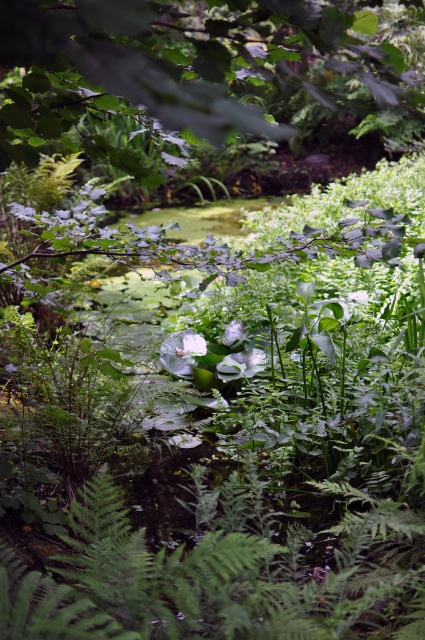
Question: Which point is closer to the camera?

Choices:
 (A) (67, 24)
 (B) (192, 356)

Answer: (A)

Question: Does green leafy tree at upper center have a larger size compared to white matte flower at center?

Choices:
 (A) yes
 (B) no

Answer: (A)

Question: Which point appears closest to the camera in this image?

Choices:
 (A) (305, 76)
 (B) (187, 374)

Answer: (B)

Question: Does green leafy tree at upper center appear over white matte flower at center?

Choices:
 (A) no
 (B) yes

Answer: (B)

Question: Does green leafy tree at upper center appear on the left side of white matte flower at center?

Choices:
 (A) yes
 (B) no

Answer: (B)